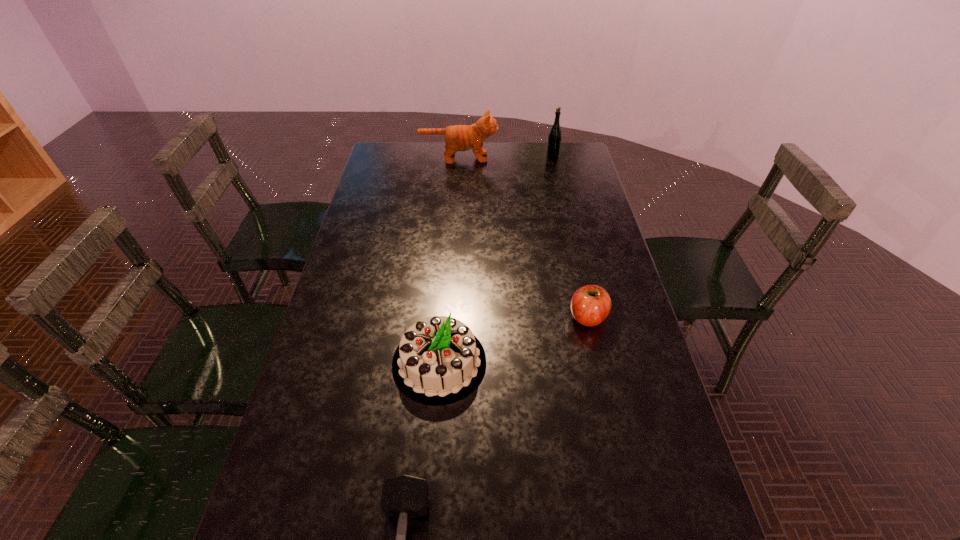
The image size is (960, 540). In order to click on beer bottle in this screenshot , I will do `click(554, 139)`.

Locate an element on the screen. cat is located at coordinates (457, 137).

Locate an element on the screen. The height and width of the screenshot is (540, 960). birthday cake is located at coordinates (439, 360).

The width and height of the screenshot is (960, 540). I want to click on apple, so click(x=590, y=305).

What are the coordinates of `vacant region located 0.090m on the right of the beer bottle` in the screenshot? It's located at (580, 157).

This screenshot has width=960, height=540. Identify the location of vacant position located 0.270m on the face of the cat. (561, 158).

What are the coordinates of `vacant region located on the back of the third tallest object` in the screenshot? It's located at (447, 258).

Find the location of a particular element. The height and width of the screenshot is (540, 960). free location located on the back of the apple is located at coordinates (567, 225).

The image size is (960, 540). I want to click on beer bottle that is at the far edge, so tap(554, 139).

Locate an element on the screen. This screenshot has height=540, width=960. cat that is positioned at the far edge is located at coordinates (457, 137).